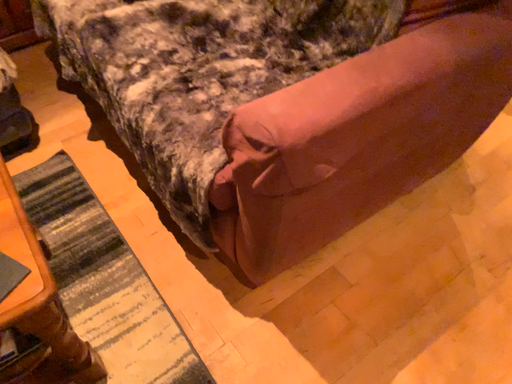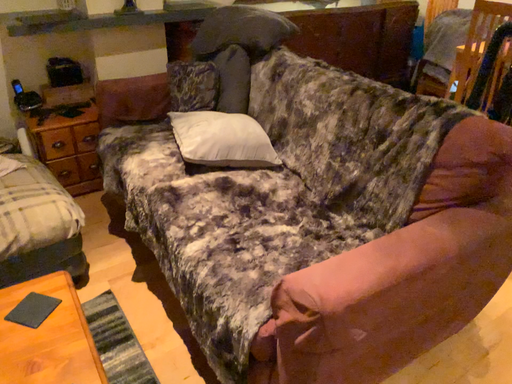
Question: How did the camera likely rotate when shooting the video?

Choices:
 (A) rotated upward
 (B) rotated downward

Answer: (A)